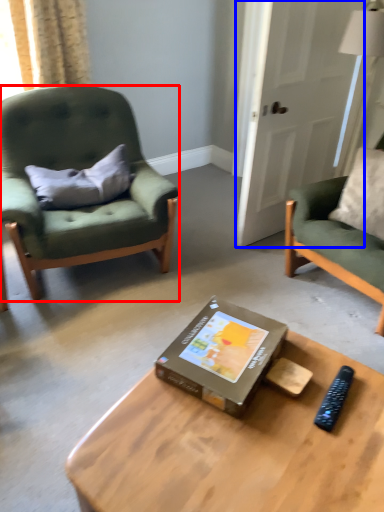
Question: Among these objects, which one is nearest to the camera, chair (highlighted by a red box) or glass door (highlighted by a blue box)?

Choices:
 (A) chair
 (B) glass door

Answer: (A)